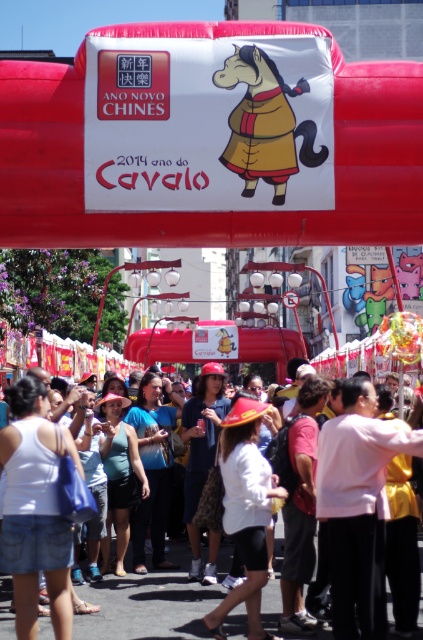
You are standing in the street festival and want to take a photo of the matte red inflatable horse at center. If your camera has a maximum focus range of 35 meters, will you be able to focus on the horse?

The matte red inflatable horse at center is 37.75 meters away from the viewer. Since the camera can only focus up to 35 meters, it cannot focus on the horse.

You are at the Chinese New Year festival and see the matte red inflatable horse at center and the white cotton crowd at center. From your perspective, which object is positioned to the right?

The matte red inflatable horse at center is to the right of the white cotton crowd at center.

You are a festival attendee standing in the crowd. You want to take a photo of the matte red inflatable horse at center with the white cotton crowd at center in the background. Will the crowd be visible behind the horse in the photo?

The matte red inflatable horse at center is much taller than the white cotton crowd at center, so the crowd will not be visible behind the horse in the photo.